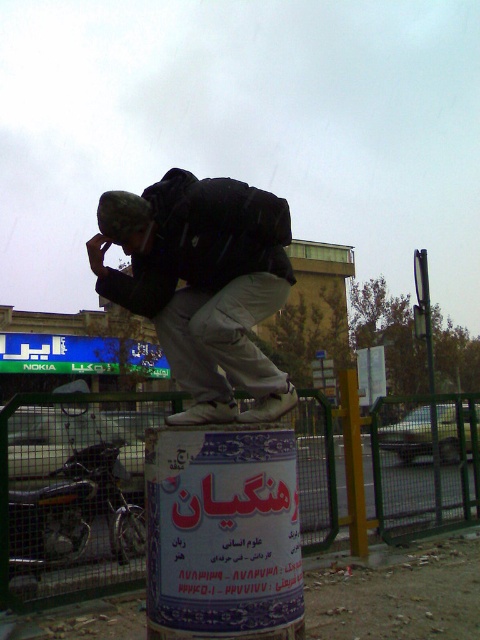
Is the position of green metal fence at lower center more distant than that of matte black backpack at left?

Yes, it is.

Is point (415, 397) in front of point (181, 296)?

No, (415, 397) is further to viewer.

You are a GUI agent. You are given a task and a screenshot of the screen. Output one action in this format:
    pyautogui.click(x=<x>, y=<y>)
    Task: Click on the green metal fence at lower center
    
    Given the screenshot: What is the action you would take?
    pyautogui.click(x=72, y=502)